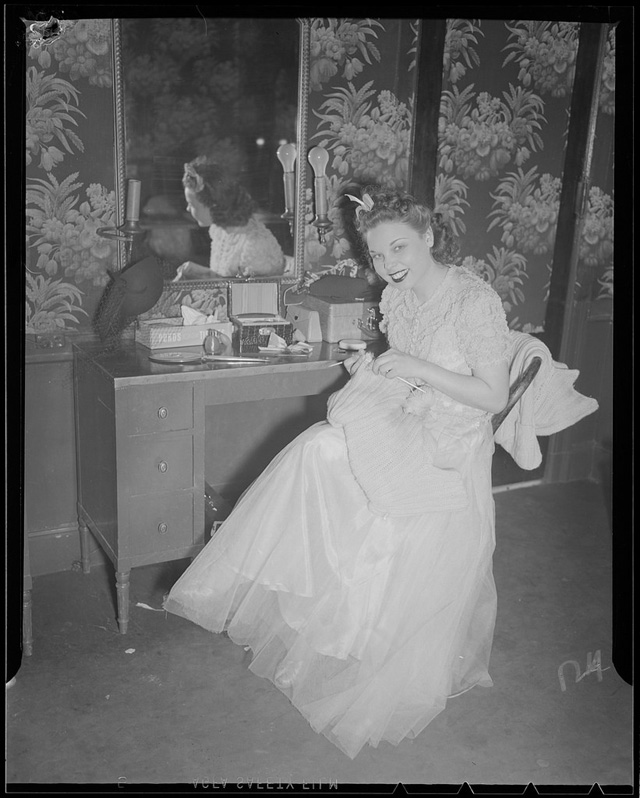
You are a GUI agent. You are given a task and a screenshot of the screen. Output one action in this format:
    pyautogui.click(x=<x>, y=<y>)
    Task: Click on the jewelry box
    Image resolution: width=640 pixels, height=798 pixels.
    Given the screenshot: What is the action you would take?
    pyautogui.click(x=264, y=314)